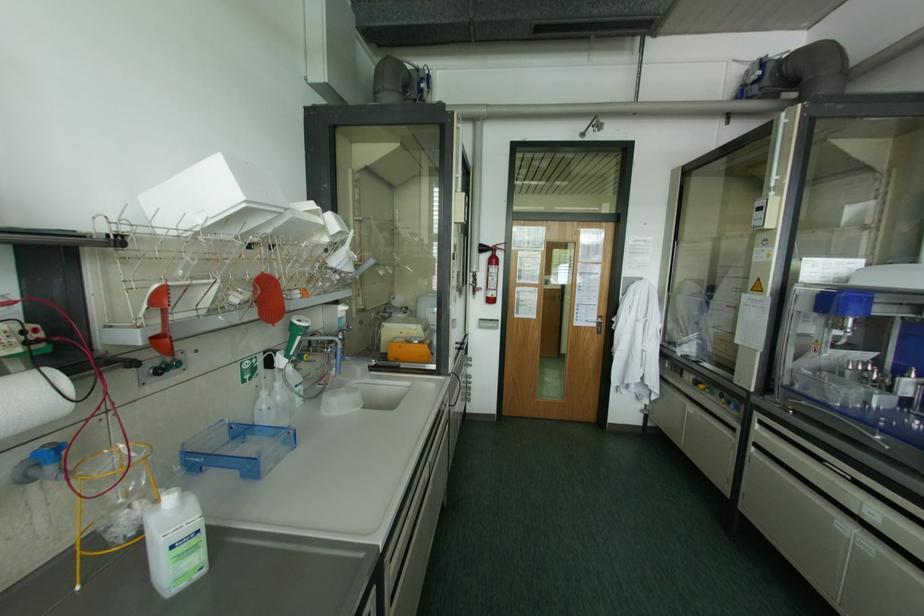
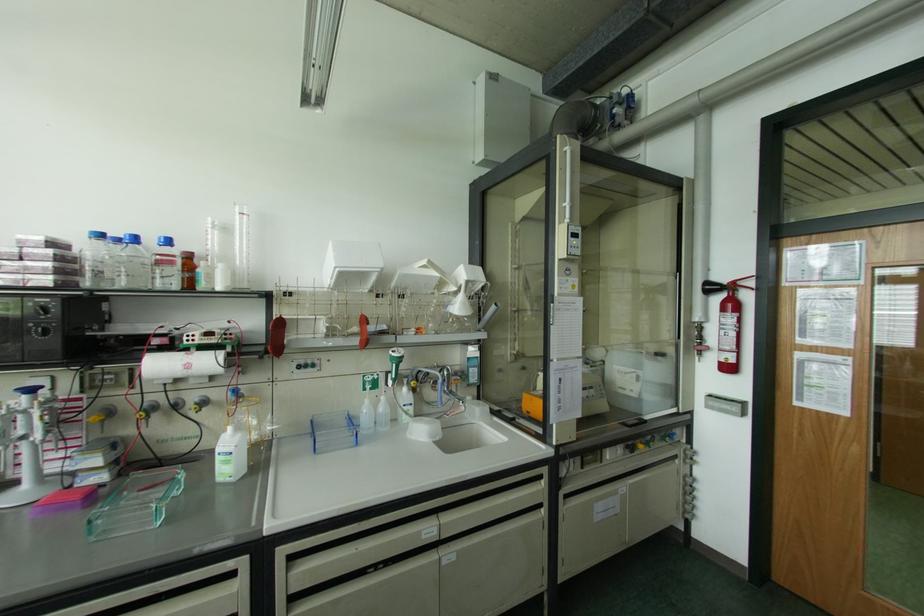
Locate, in the second image, the point that corresponds to pixel 190 499 in the first image.

(238, 435)